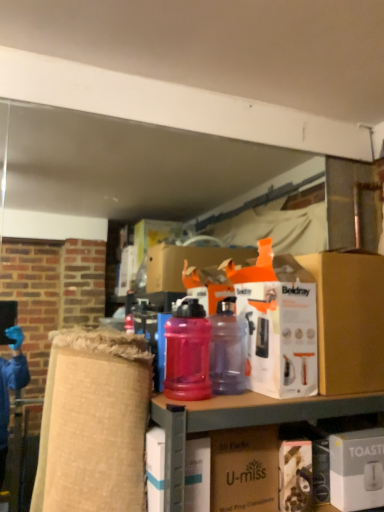
Question: Is white cardboard box at center, which is the first box from left to right, wider than orange cardboard box at center, the second box viewed from the left?

Choices:
 (A) no
 (B) yes

Answer: (A)

Question: Does white cardboard box at center, which is the first box from left to right, have a lesser width compared to orange cardboard box at center, the 2th box when ordered from right to left?

Choices:
 (A) yes
 (B) no

Answer: (A)

Question: Can you confirm if white cardboard box at center, which is the first box from left to right, is positioned to the right of orange cardboard box at center, the second box viewed from the left?

Choices:
 (A) no
 (B) yes

Answer: (A)

Question: Can you confirm if white cardboard box at center, which is the first box from left to right, is taller than orange cardboard box at center, the second box viewed from the left?

Choices:
 (A) no
 (B) yes

Answer: (A)

Question: Can you confirm if white cardboard box at center, arranged as the 3th box when viewed from the right, is smaller than orange cardboard box at center, the second box viewed from the left?

Choices:
 (A) no
 (B) yes

Answer: (B)

Question: From the image's perspective, is white cardboard box at center, arranged as the 3th box when viewed from the right, located above orange cardboard box at center, the 2th box when ordered from right to left?

Choices:
 (A) no
 (B) yes

Answer: (A)

Question: Is matte brown cardboard box at center positioned with its back to translucent plastic water bottle at center, the 2th bottle when ordered from right to left?

Choices:
 (A) yes
 (B) no

Answer: (B)

Question: Is matte brown cardboard box at center taller than translucent plastic water bottle at center, arranged as the 1th bottle when viewed from the left?

Choices:
 (A) yes
 (B) no

Answer: (B)

Question: Is matte brown cardboard box at center closer to camera compared to translucent plastic water bottle at center, the 2th bottle when ordered from right to left?

Choices:
 (A) no
 (B) yes

Answer: (B)

Question: Considering the relative sizes of matte brown cardboard box at center and translucent plastic water bottle at center, arranged as the 1th bottle when viewed from the left, in the image provided, is matte brown cardboard box at center smaller than translucent plastic water bottle at center, arranged as the 1th bottle when viewed from the left,?

Choices:
 (A) no
 (B) yes

Answer: (A)

Question: Is matte brown cardboard box at center not close to translucent plastic water bottle at center, arranged as the 1th bottle when viewed from the left?

Choices:
 (A) no
 (B) yes

Answer: (A)

Question: Is matte brown cardboard box at center at the right side of translucent plastic water bottle at center, arranged as the 1th bottle when viewed from the left?

Choices:
 (A) no
 (B) yes

Answer: (B)

Question: Considering the relative sizes of white matte toaster at lower right, the third box positioned from the left, and orange cardboard box at center, the 2th box when ordered from right to left, in the image provided, is white matte toaster at lower right, the third box positioned from the left, bigger than orange cardboard box at center, the 2th box when ordered from right to left,?

Choices:
 (A) yes
 (B) no

Answer: (B)